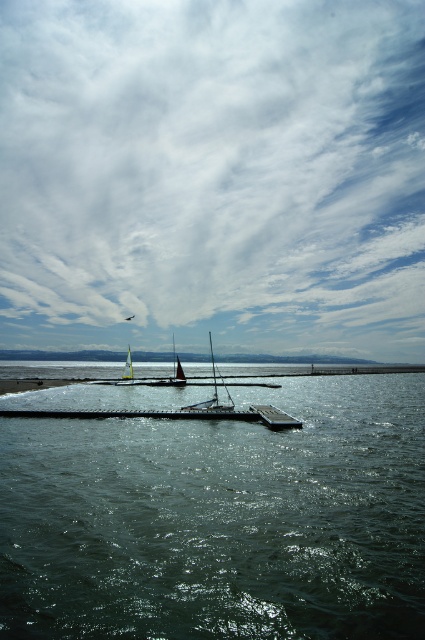
Question: From the image, what is the correct spatial relationship of metallic gray dock at center in relation to white glossy sailboat at center?

Choices:
 (A) left
 (B) right

Answer: (A)

Question: Which point appears closest to the camera in this image?

Choices:
 (A) (200, 410)
 (B) (70, 184)

Answer: (A)

Question: Can you confirm if dark green water at center is positioned below white glossy sailboat at center?

Choices:
 (A) yes
 (B) no

Answer: (B)

Question: Which object is the farthest from the metallic gray dock at center?

Choices:
 (A) red sailboat at center
 (B) white fluffy cloud at upper center

Answer: (B)

Question: Which point appears closest to the camera in this image?

Choices:
 (A) (217, 408)
 (B) (274, 413)

Answer: (B)

Question: Is the position of white fluffy cloud at upper center less distant than that of dark green water at center?

Choices:
 (A) yes
 (B) no

Answer: (B)